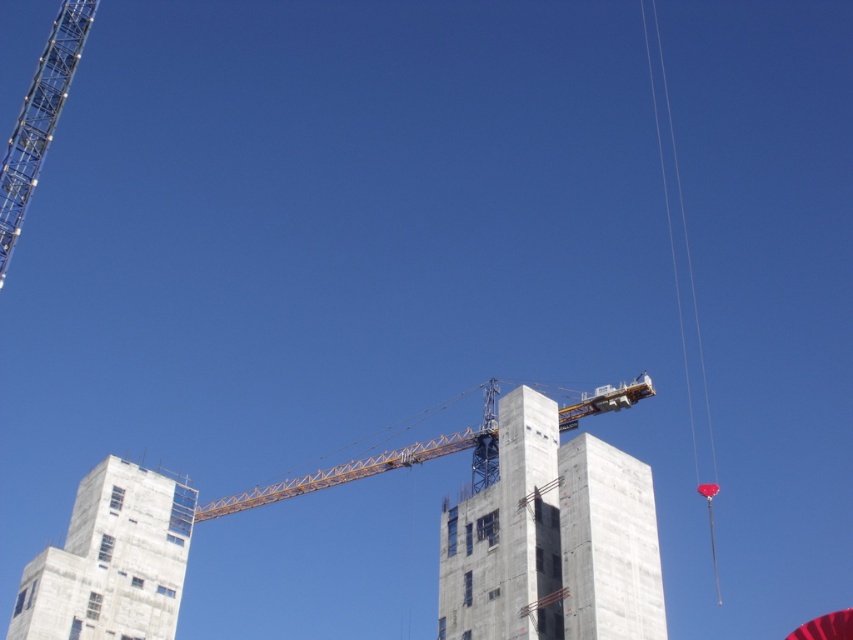
You are an architect observing the construction site. You notice two cranes in the scene. Which one is taller between the metallic silver crane at upper left and the yellow metallic crane at center?

The metallic silver crane at upper left is much taller than the yellow metallic crane at center.

Based on the photo, you are an engineer inspecting a construction site. You need to ensure that the concrete at center can be safely lifted by the metallic silver crane at upper left. Based on their positions, is the crane able to reach the concrete?

The concrete at center is positioned on the right side of metallic silver crane at upper left, so the crane can reach it as it is within its operational range.

You are a construction worker who needs to transport materials from the concrete building at lower left to the concrete at center. Given that your vehicle can carry a maximum load of 5 tons, and the distance between them is 36.79 meters, can you safely make this trip without exceeding the vehicle capacity?

The distance between the concrete at center and the concrete building at lower left is 36.79 meters. However, the question about the vehicle capacity and distance does not provide information about the weight of the materials to be transported. Without knowing the weight of the materials, it is impossible to determine if the 5 ton capacity will be exceeded. Please provide the weight of the materials for an accurate assessment.